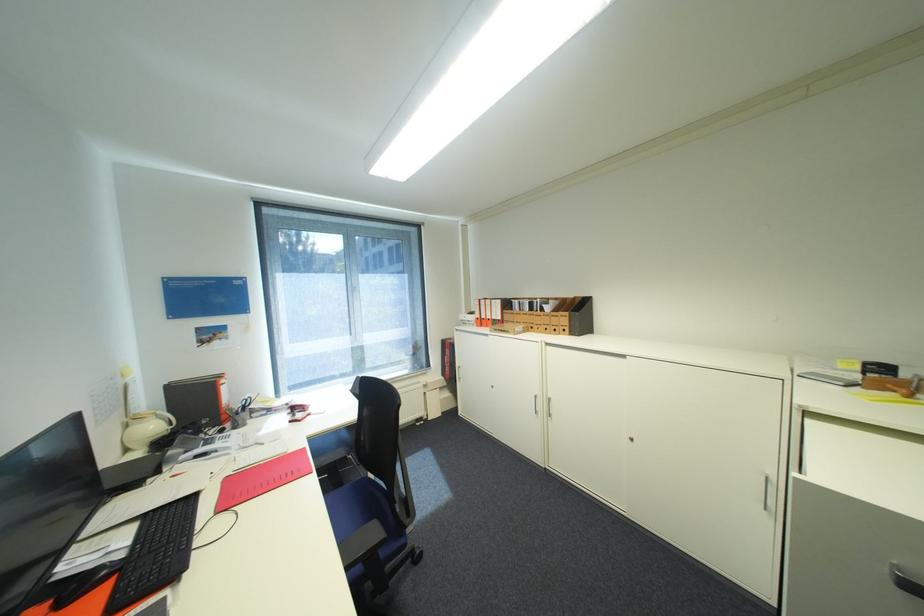
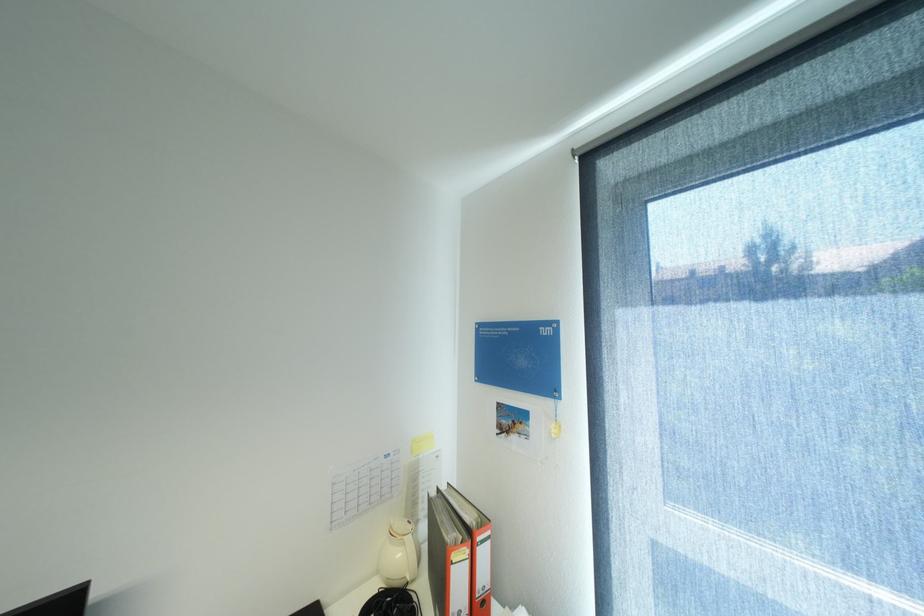
The point at (161, 427) is marked in the first image. Where is the corresponding point in the second image?

(407, 554)